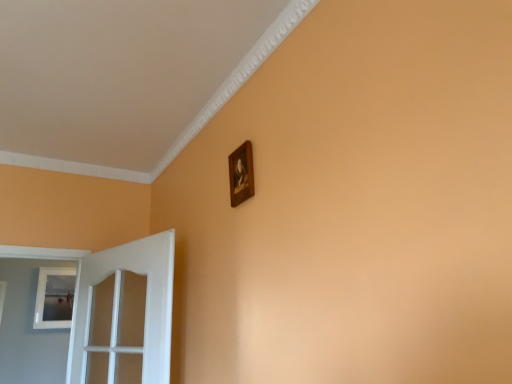
Question: Are white matte picture frame at left, arranged as the 2th picture frame when viewed from the right, and white glossy door at left beside each other?

Choices:
 (A) no
 (B) yes

Answer: (A)

Question: Could white glossy door at left be considered to be inside white matte picture frame at left, acting as the 1th picture frame starting from the bottom?

Choices:
 (A) no
 (B) yes

Answer: (A)

Question: Considering the relative positions of white matte picture frame at left, arranged as the 2th picture frame when viewed from the right, and white glossy door at left in the image provided, is white matte picture frame at left, arranged as the 2th picture frame when viewed from the right, to the right of white glossy door at left from the viewer's perspective?

Choices:
 (A) yes
 (B) no

Answer: (B)

Question: Can you confirm if white matte picture frame at left, which ranks as the second picture frame in front-to-back order, is thinner than white glossy door at left?

Choices:
 (A) yes
 (B) no

Answer: (A)

Question: From a real-world perspective, is white matte picture frame at left, which ranks as the second picture frame in front-to-back order, beneath white glossy door at left?

Choices:
 (A) yes
 (B) no

Answer: (B)

Question: Is white matte picture frame at left, which ranks as the second picture frame in front-to-back order, wider or thinner than wooden frame at upper center, the first picture frame in the top-to-bottom sequence?

Choices:
 (A) wide
 (B) thin

Answer: (A)

Question: From the image's perspective, is white matte picture frame at left, which ranks as the 1th picture frame in left-to-right order, located above or below wooden frame at upper center, which appears as the 2th picture frame when ordered from the bottom?

Choices:
 (A) below
 (B) above

Answer: (A)

Question: Is point (35, 311) positioned closer to the camera than point (242, 173)?

Choices:
 (A) farther
 (B) closer

Answer: (A)

Question: Based on their positions, is white matte picture frame at left, acting as the 1th picture frame starting from the bottom, located to the left or right of wooden frame at upper center, which is counted as the 1th picture frame, starting from the front?

Choices:
 (A) left
 (B) right

Answer: (A)

Question: Is white matte picture frame at left, which ranks as the second picture frame in front-to-back order, inside or outside of white glossy door at left?

Choices:
 (A) outside
 (B) inside

Answer: (A)

Question: From the image's perspective, is white matte picture frame at left, which ranks as the 1th picture frame in left-to-right order, located above or below white glossy door at left?

Choices:
 (A) below
 (B) above

Answer: (A)

Question: Considering the positions of white matte picture frame at left, positioned as the 2th picture frame in top-to-bottom order, and white glossy door at left in the image, is white matte picture frame at left, positioned as the 2th picture frame in top-to-bottom order, bigger or smaller than white glossy door at left?

Choices:
 (A) big
 (B) small

Answer: (B)

Question: Considering their positions, is white matte picture frame at left, positioned as the 2th picture frame in top-to-bottom order, located in front of or behind white glossy door at left?

Choices:
 (A) behind
 (B) front

Answer: (A)

Question: From the image's perspective, relative to wooden frame at upper center, the first picture frame in the right-to-left sequence, is white glossy door at left above or below?

Choices:
 (A) below
 (B) above

Answer: (A)

Question: From a real-world perspective, is white glossy door at left positioned above or below wooden frame at upper center, the first picture frame in the top-to-bottom sequence?

Choices:
 (A) above
 (B) below

Answer: (B)